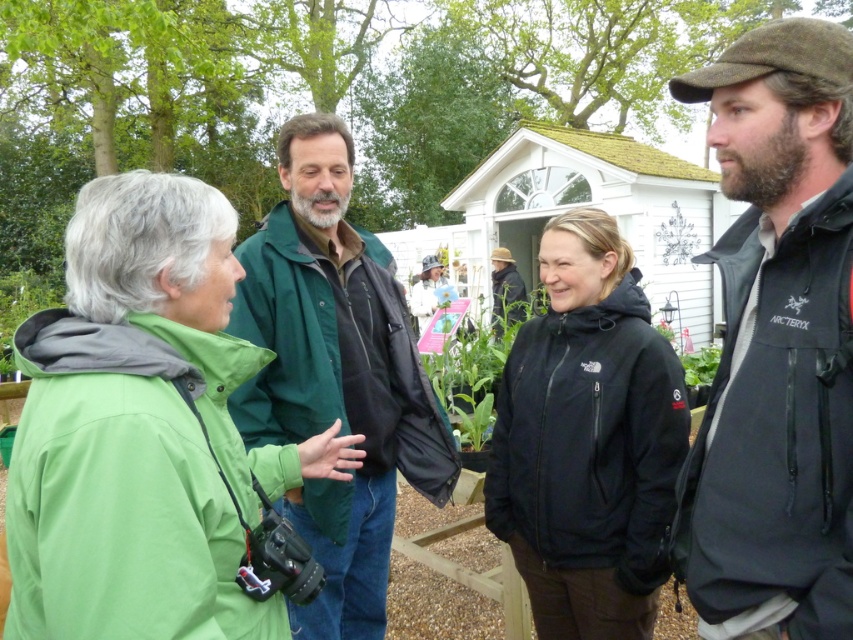
Based on the photo, you are standing at the center of the garden and want to take a photo of the dark brown wool cap at upper right without including the black softshell jacket at center in the frame. Which direction should you move to ensure the jacket is out of the shot?

Move to the left so that the black softshell jacket at center is no longer in the frame while keeping the dark brown wool cap at upper right in view.

You are standing in the garden scene and want to take a photo of the green leafy plant at upper left. Since you are holding a camera, where should you look to capture it in your shot?

The green leafy plant at upper left is located at point (x=22, y=305), so you should look towards the upper left direction to capture it in your photo.